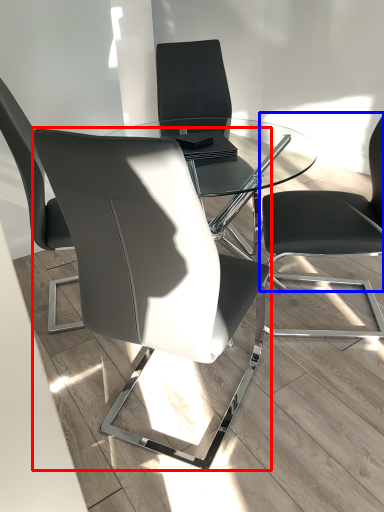
Question: Which object is further to the camera taking this photo, chair (highlighted by a red box) or chair (highlighted by a blue box)?

Choices:
 (A) chair
 (B) chair

Answer: (B)